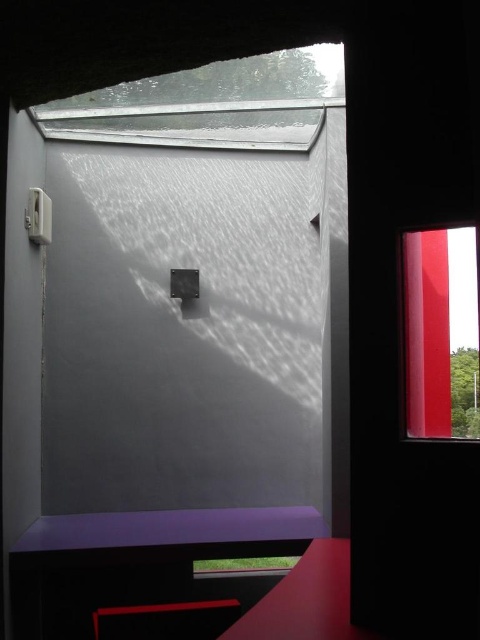
Based on the photo, you are standing outside the window looking into the room. You see a purple matte table at lower center and a matte purple stool at lower center. Which object is closer to the left side of the window?

The purple matte table at lower center is to the left of the matte purple stool at lower center, so it is closer to the left side of the window.

You are standing outside the window looking into the room. There are two points marked on the wall inside the room. The first point is at coordinates point (126, 554) and the second is at point (132, 620). Which point is closer to the window frame?

Point (126, 554) is behind point (132, 620). Since point (132, 620) is closer to the window frame, it would be the one nearer to you as you look through the window.